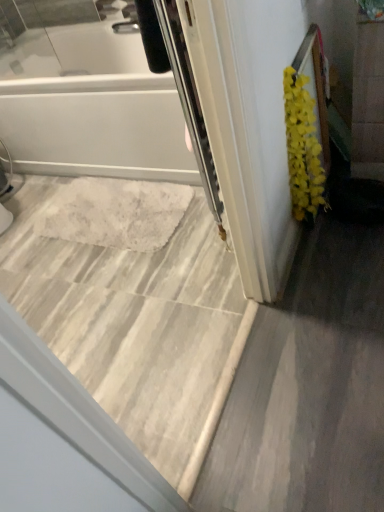
Question: From a real-world perspective, is white glossy bathtub at upper left located beneath yellow fluffy plant at right?

Choices:
 (A) no
 (B) yes

Answer: (A)

Question: Is white glossy bathtub at upper left wider than yellow fluffy plant at right?

Choices:
 (A) no
 (B) yes

Answer: (B)

Question: Is white glossy bathtub at upper left smaller than yellow fluffy plant at right?

Choices:
 (A) yes
 (B) no

Answer: (B)

Question: From the image's perspective, is white glossy bathtub at upper left on top of yellow fluffy plant at right?

Choices:
 (A) yes
 (B) no

Answer: (A)

Question: Is white glossy bathtub at upper left oriented away from yellow fluffy plant at right?

Choices:
 (A) yes
 (B) no

Answer: (B)

Question: Is white glossy bathtub at upper left taller than yellow fluffy plant at right?

Choices:
 (A) yes
 (B) no

Answer: (B)

Question: Would you say white glossy bathtub at upper left is part of yellow fluffy plant at right's contents?

Choices:
 (A) yes
 (B) no

Answer: (B)

Question: Is yellow fluffy plant at right shorter than white glossy bathtub at upper left?

Choices:
 (A) yes
 (B) no

Answer: (B)

Question: From a real-world perspective, is yellow fluffy plant at right over white glossy bathtub at upper left?

Choices:
 (A) no
 (B) yes

Answer: (A)

Question: Can you confirm if yellow fluffy plant at right is bigger than white glossy bathtub at upper left?

Choices:
 (A) yes
 (B) no

Answer: (B)

Question: Does yellow fluffy plant at right touch white glossy bathtub at upper left?

Choices:
 (A) yes
 (B) no

Answer: (B)

Question: Considering the relative sizes of yellow fluffy plant at right and white glossy bathtub at upper left in the image provided, is yellow fluffy plant at right taller than white glossy bathtub at upper left?

Choices:
 (A) no
 (B) yes

Answer: (B)

Question: From a real-world perspective, is marble tile floor at center positioned over yellow fluffy plant at right based on gravity?

Choices:
 (A) yes
 (B) no

Answer: (B)